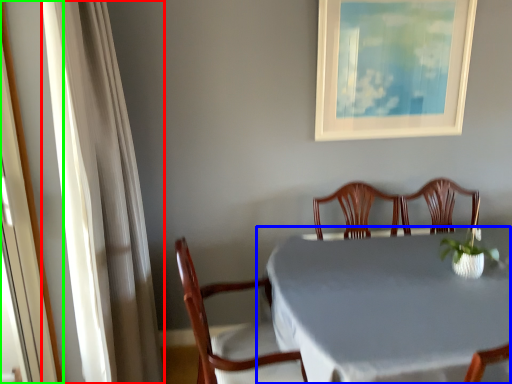
Question: Based on their relative distances, which object is farther from curtain (highlighted by a red box)? Choose from table (highlighted by a blue box) and screen door (highlighted by a green box).

Choices:
 (A) table
 (B) screen door

Answer: (A)